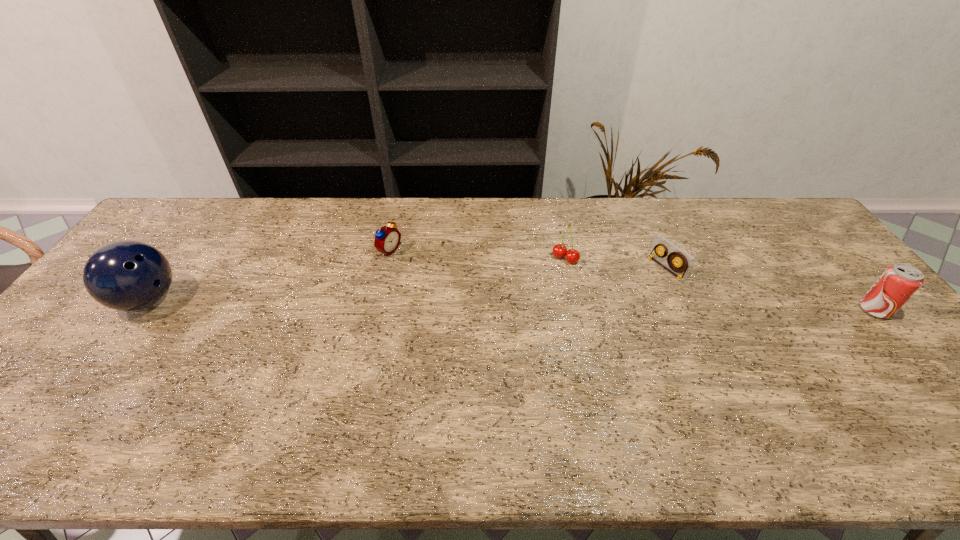
At what (x,y) coordinates should I click in order to perform the action: click on vacant point located on the front-facing side of the alarm clock. Please return your answer as a coordinate pair (x, y). This screenshot has height=540, width=960. Looking at the image, I should click on (432, 272).

This screenshot has height=540, width=960. Find the location of `vacant space situated on the front-facing side of the alarm clock`. vacant space situated on the front-facing side of the alarm clock is located at coordinates (463, 286).

Image resolution: width=960 pixels, height=540 pixels. In order to click on vacant region located 0.260m on the front-facing side of the alarm clock in this screenshot , I will do `click(468, 288)`.

Locate an element on the screen. Image resolution: width=960 pixels, height=540 pixels. free spot located 0.200m with the stems of the third object from left to right pointing upwards is located at coordinates (527, 305).

The height and width of the screenshot is (540, 960). I want to click on vacant point located with the stems of the third object from left to right pointing upwards, so click(x=493, y=346).

Identify the location of vacant space located with the stems of the third object from left to right pointing upwards. Image resolution: width=960 pixels, height=540 pixels. (527, 305).

At what (x,y) coordinates should I click in order to perform the action: click on vacant space positioned at the front of the shortest object with visible reels. Please return your answer as a coordinate pair (x, y). The image size is (960, 540). Looking at the image, I should click on (571, 322).

You are a GUI agent. You are given a task and a screenshot of the screen. Output one action in this format:
    pyautogui.click(x=<x>, y=<y>)
    Task: Click on the vacant area situated 0.370m at the front of the shortest object with visible reels
    Image resolution: width=960 pixels, height=540 pixels.
    Given the screenshot: What is the action you would take?
    pyautogui.click(x=560, y=328)

I want to click on vacant area situated at the front of the shortest object with visible reels, so click(619, 296).

Locate an element on the screen. This screenshot has height=540, width=960. object that is at the left edge is located at coordinates (127, 275).